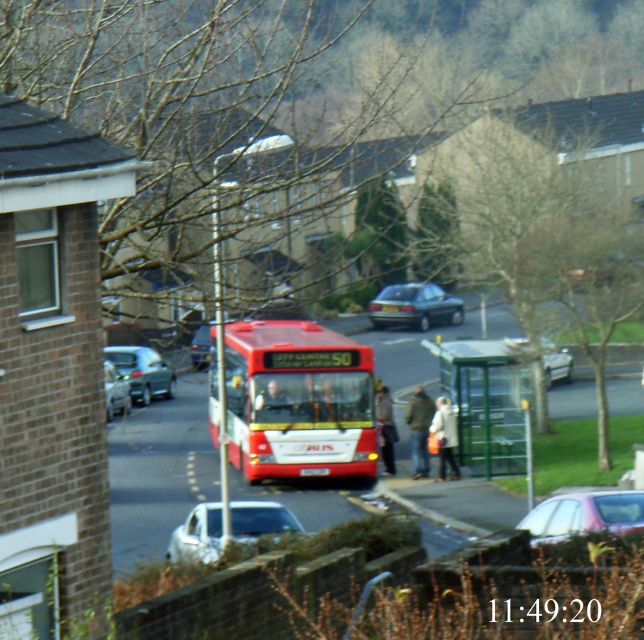
Question: Based on their relative distances, which object is farther from the matte black car at center?

Choices:
 (A) silver metallic sedan at center
 (B) red matte bus at center
 (C) silver metallic car at center-left
 (D) white fabric coat at center

Answer: (D)

Question: Can you confirm if silver metallic hatchback at left is wider than dark gray fabric jacket at center?

Choices:
 (A) yes
 (B) no

Answer: (A)

Question: Among these points, which one is farthest from the camera?

Choices:
 (A) (419, 403)
 (B) (383, 449)

Answer: (A)

Question: Which of these objects is positioned farthest from the silver metallic sedan at center?

Choices:
 (A) red matte bus at center
 (B) silver metallic hatchback at left
 (C) dark brown leather jacket at center

Answer: (B)

Question: Is silver metallic hatchback at left thinner than silver metallic sedan at center?

Choices:
 (A) no
 (B) yes

Answer: (B)

Question: Is white fabric coat at center bigger than silver metallic sedan at center?

Choices:
 (A) yes
 (B) no

Answer: (B)